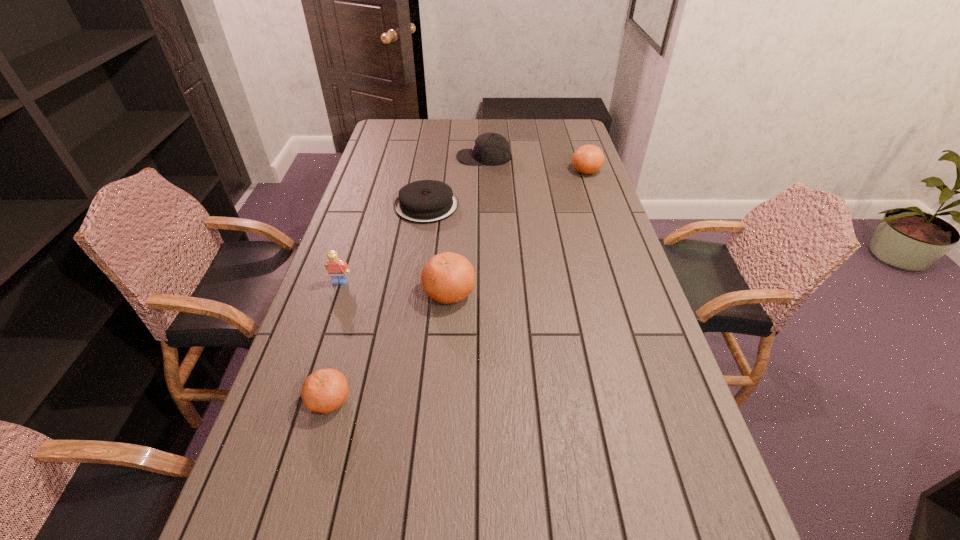
Where is `Lego located in the left edge section of the desktop`? This screenshot has width=960, height=540. Lego located in the left edge section of the desktop is located at coordinates (337, 268).

Identify the location of object at the right edge. (588, 159).

Find the location of a particular element. blank space at the far edge is located at coordinates (426, 132).

In the image, there is a desktop. At what (x,y) coordinates should I click in order to perform the action: click on blank space at the near edge. Please return your answer as a coordinate pair (x, y). Looking at the image, I should click on (x=485, y=477).

The image size is (960, 540). In the image, there is a desktop. Identify the location of free space at the left edge. (396, 147).

Find the location of `vacant space at the right edge`. vacant space at the right edge is located at coordinates (571, 224).

Identify the location of vacant space at the far left corner of the desktop. This screenshot has height=540, width=960. (386, 133).

Image resolution: width=960 pixels, height=540 pixels. What are the coordinates of `vacant region at the far right corner of the desktop` in the screenshot? It's located at (546, 127).

Where is `vacant area that lies between the cap and the second farthest clementine`? This screenshot has height=540, width=960. vacant area that lies between the cap and the second farthest clementine is located at coordinates (467, 225).

Find the location of a particular element. free space that is in between the rightmost clementine and the cap is located at coordinates (535, 164).